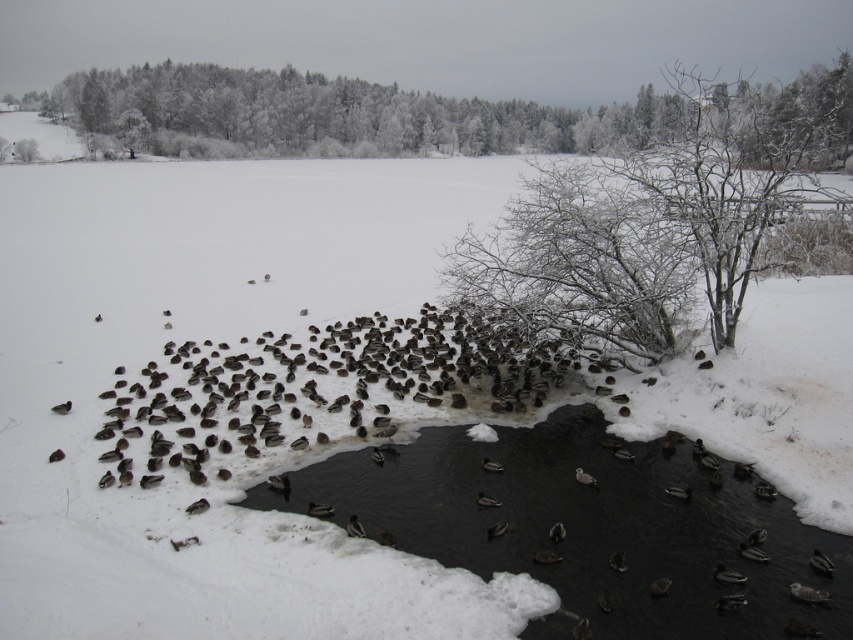
Question: Does black ice stream at lower center come behind white frosty tree at upper center?

Choices:
 (A) no
 (B) yes

Answer: (A)

Question: Is white frosty tree at upper center above dark brown feathers at center?

Choices:
 (A) no
 (B) yes

Answer: (B)

Question: Among these points, which one is farthest from the camera?

Choices:
 (A) (358, 531)
 (B) (693, 294)
 (C) (277, 140)
 (D) (407, 486)

Answer: (C)

Question: Among these objects, which one is farthest from the camera?

Choices:
 (A) white frosty tree at upper center
 (B) snow-covered branches at center

Answer: (A)

Question: Which object is the closest to the dark brown feathers at center?

Choices:
 (A) white frosty tree at upper center
 (B) snow-covered branches at center

Answer: (B)

Question: Is white frosty tree at upper center bigger than dark brown feathers at center?

Choices:
 (A) no
 (B) yes

Answer: (B)